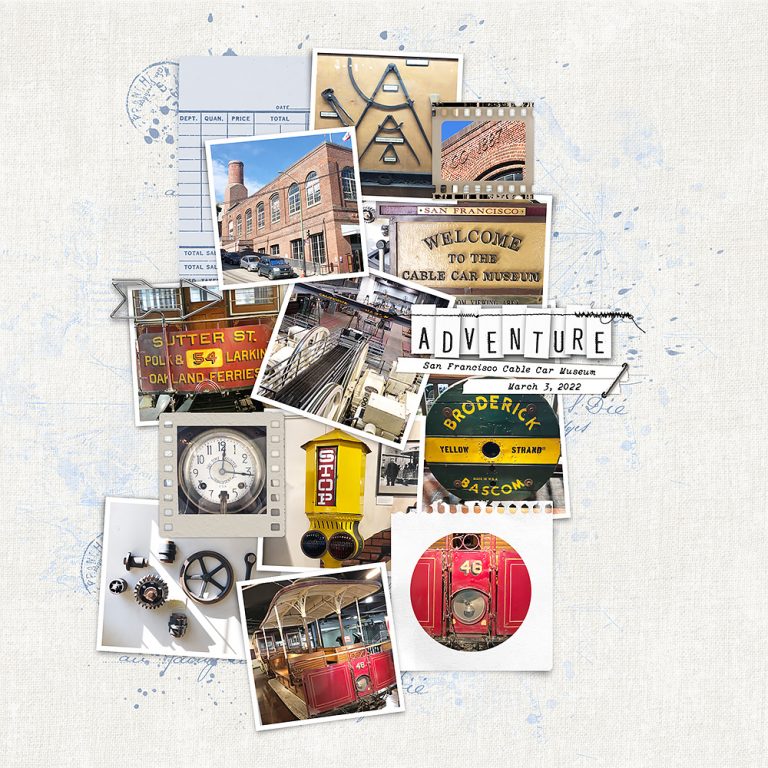
What are the coordinates of `pic of silver bordered clock` in the screenshot? It's located at pyautogui.click(x=186, y=447).